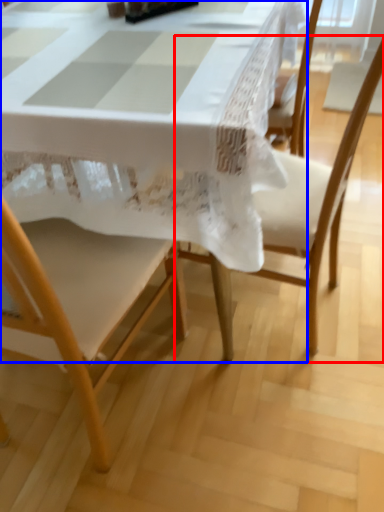
Question: Which object is closer to the camera taking this photo, chair (highlighted by a red box) or table (highlighted by a blue box)?

Choices:
 (A) chair
 (B) table

Answer: (A)